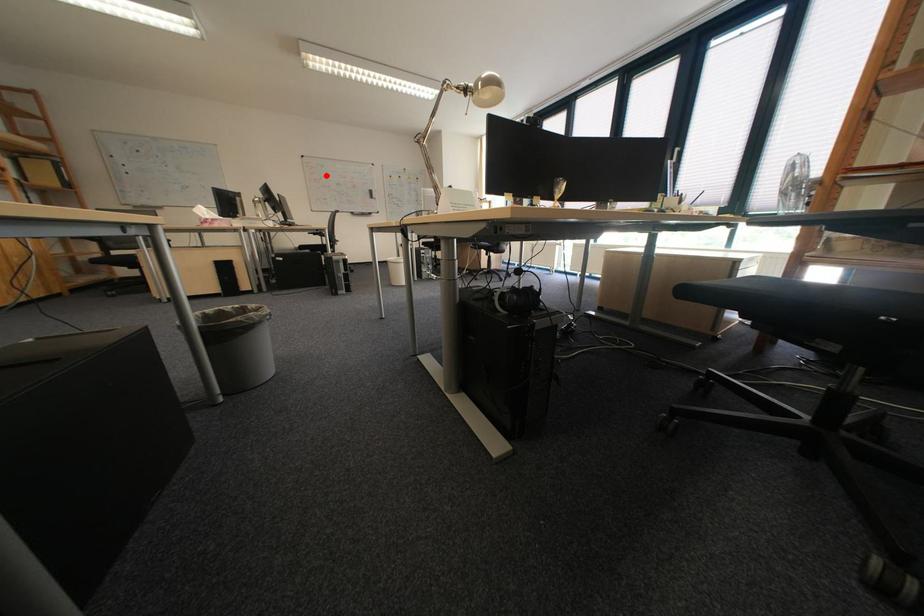
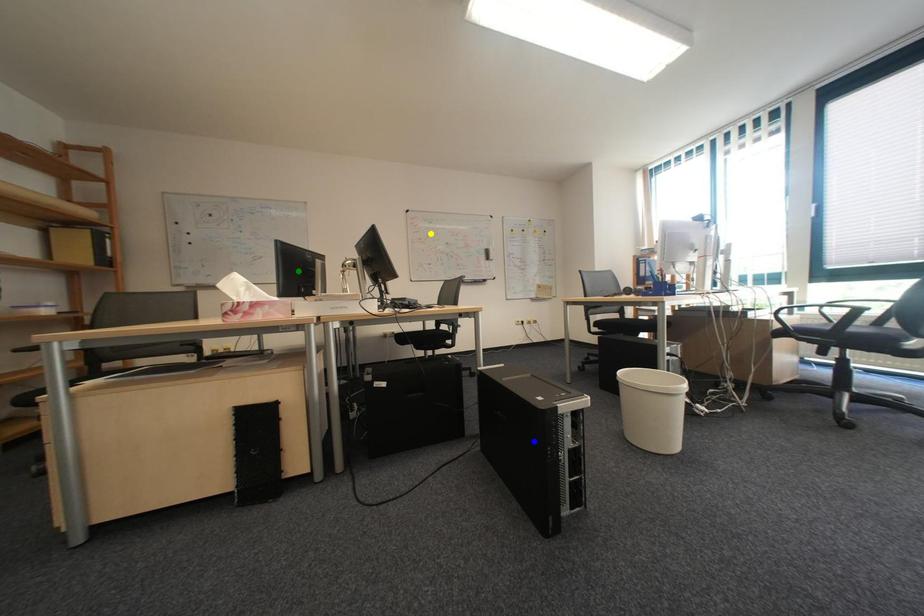
Question: I am providing you with two images of the same scene from different viewpoints. A red point is marked on the first image. You are given multiple points on the second image. Which spot in image 2 lines up with the point in image 1?

Choices:
 (A) blue point
 (B) yellow point
 (C) green point

Answer: (B)